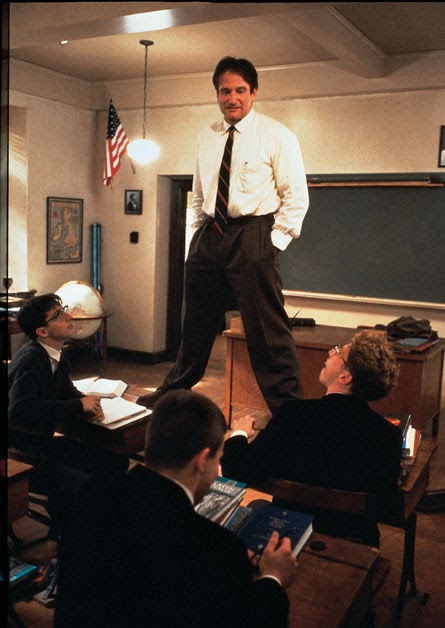
The width and height of the screenshot is (445, 628). Identify the location of lights. (141, 152).